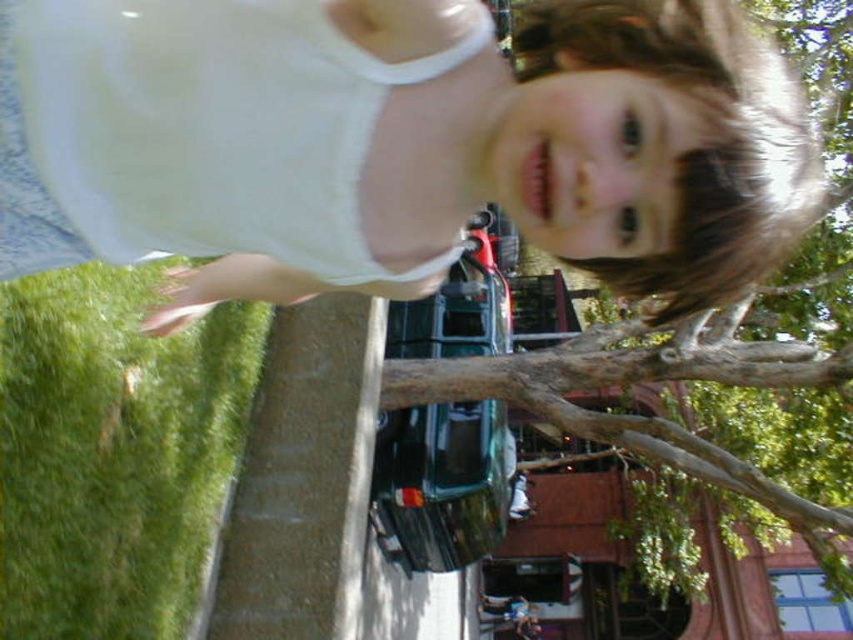
From the picture: Which is below, white cotton shirt at upper center or brown rough tree at upper center?

brown rough tree at upper center is lower down.

Who is shorter, white cotton shirt at upper center or brown rough tree at upper center?

white cotton shirt at upper center is shorter.

Which is behind, point (688, 64) or point (440, 369)?

Point (440, 369)

Locate an element on the screen. The width and height of the screenshot is (853, 640). white cotton shirt at upper center is located at coordinates (399, 144).

The image size is (853, 640). I want to click on brown rough tree at upper center, so click(x=631, y=416).

Which is below, brown rough tree at upper center or brown rough tree branch at center?

brown rough tree at upper center is below.

Does point (572, 429) come in front of point (633, 349)?

Yes.

Locate an element on the screen. The image size is (853, 640). brown rough tree at upper center is located at coordinates (631, 416).

Does white cotton shirt at upper center have a greater width compared to brown rough tree branch at center?

No, white cotton shirt at upper center is not wider than brown rough tree branch at center.

Is point (392, 209) less distant than point (746, 384)?

Yes, point (392, 209) is closer to viewer.

This screenshot has width=853, height=640. Find the location of `white cotton shirt at upper center`. white cotton shirt at upper center is located at coordinates (399, 144).